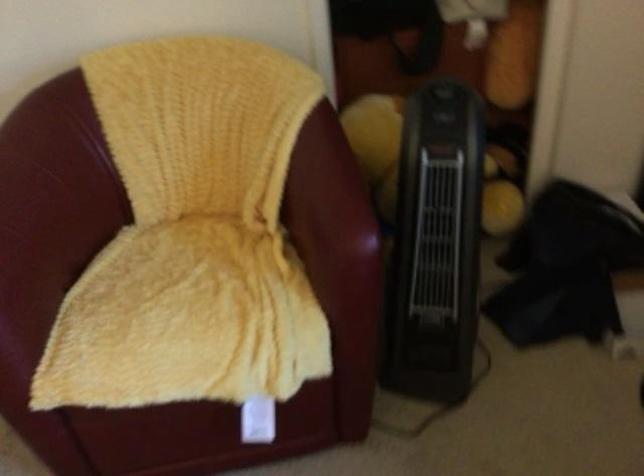
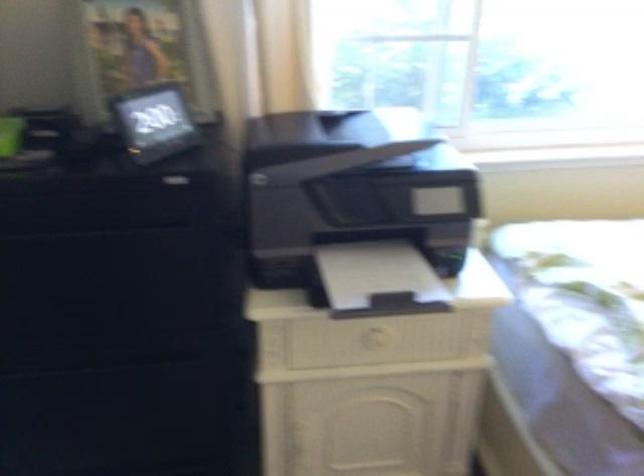
How did the camera likely rotate?

The camera's rotation is toward right-down.